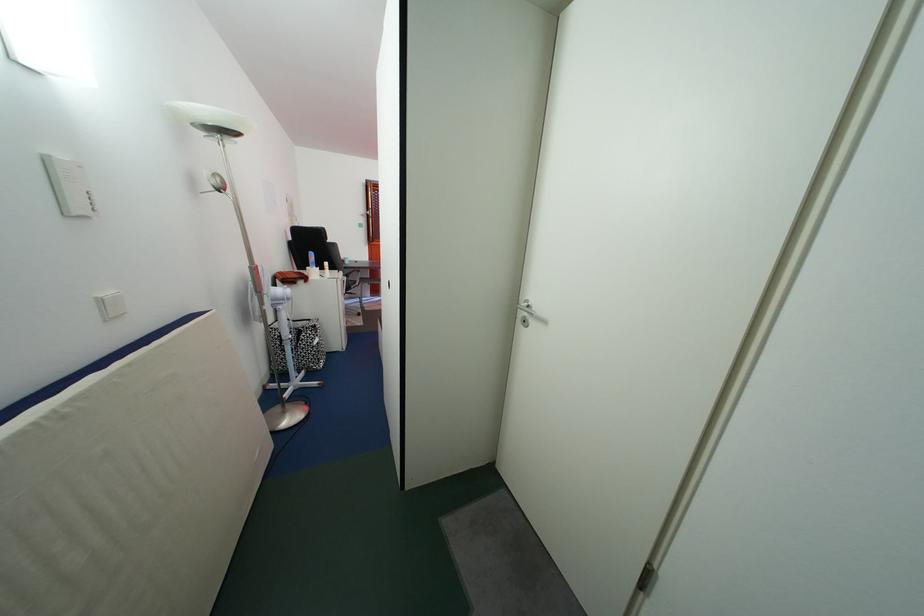
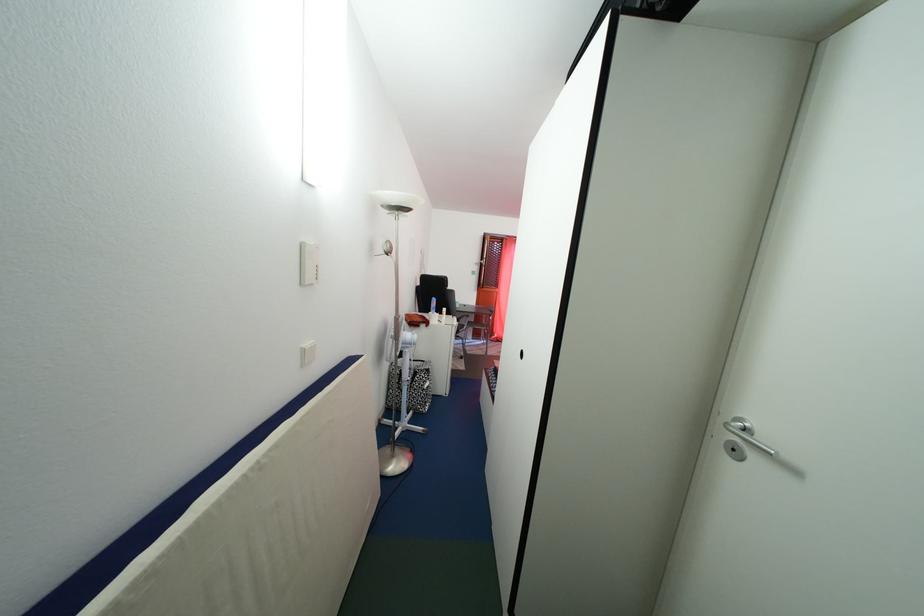
The point at (108, 307) is marked in the first image. Where is the corresponding point in the second image?

(311, 358)